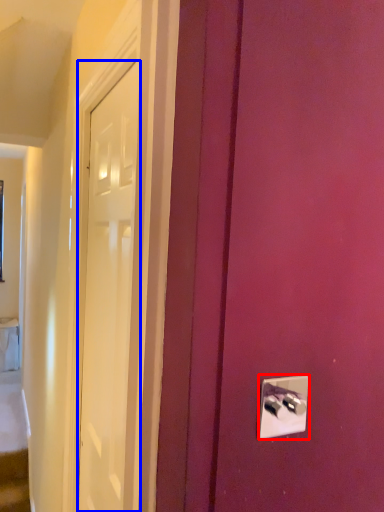
Question: Among these objects, which one is nearest to the camera, light switch (highlighted by a red box) or door (highlighted by a blue box)?

Choices:
 (A) light switch
 (B) door

Answer: (A)